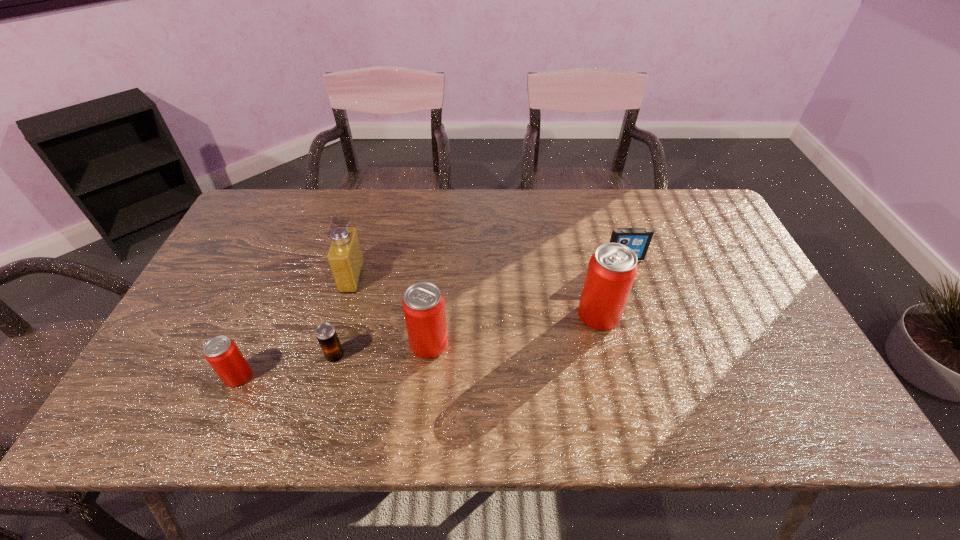
Locate an element on the screen. This screenshot has height=540, width=960. free point located on the right of the fourth object from left to right is located at coordinates (505, 344).

Identify the location of free location located on the back of the rightmost can. (574, 211).

Identify the location of vacant space located on the front-facing side of the fifth nearest object. (379, 278).

Identify the location of vacant region located 0.300m on the front screen of the rightmost object. (654, 345).

Locate an element on the screen. vacant space located 0.190m on the right of the beer can is located at coordinates (423, 356).

Locate an element on the screen. This screenshot has width=960, height=540. beer can that is at the near edge is located at coordinates (326, 334).

The height and width of the screenshot is (540, 960). In order to click on vacant space at the far edge in this screenshot , I will do `click(446, 229)`.

The height and width of the screenshot is (540, 960). In the image, there is a desktop. Identify the location of vacant space at the near edge. pyautogui.click(x=726, y=368).

Locate an element on the screen. The width and height of the screenshot is (960, 540). free space at the left edge is located at coordinates [x=198, y=304].

Identify the location of free space at the right edge. Image resolution: width=960 pixels, height=540 pixels. (710, 266).